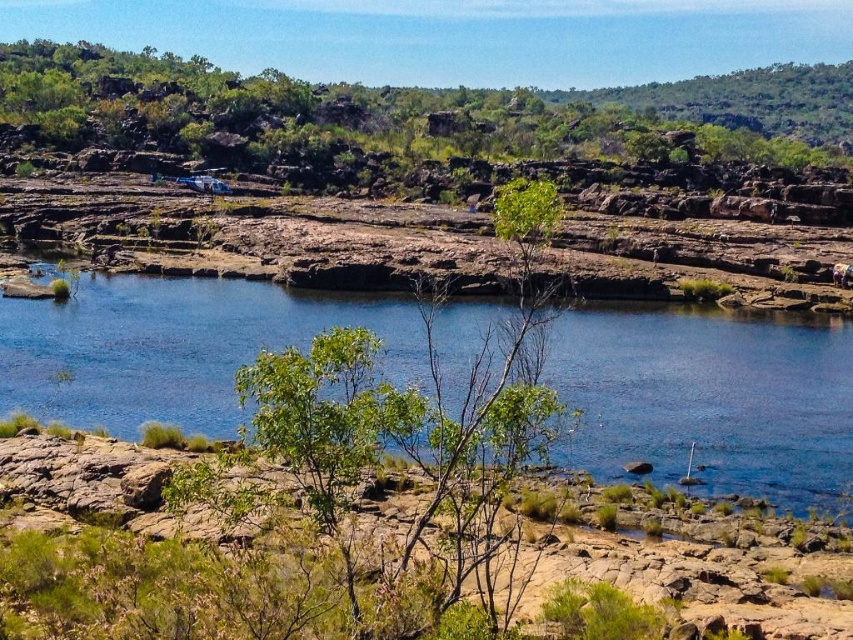
How much distance is there between blue smooth water at center and green leafy tree at upper center?

The distance of blue smooth water at center from green leafy tree at upper center is 362.80 feet.

How much distance is there between blue smooth water at center and green leafy tree at upper center?

blue smooth water at center and green leafy tree at upper center are 110.58 meters apart.

This screenshot has width=853, height=640. What do you see at coordinates (709, 400) in the screenshot?
I see `blue smooth water at center` at bounding box center [709, 400].

The image size is (853, 640). Find the location of `blue smooth water at center`. blue smooth water at center is located at coordinates (709, 400).